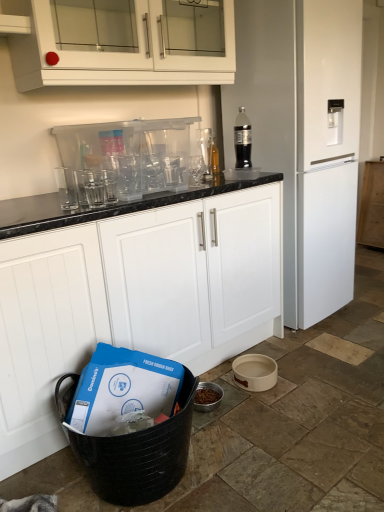
You are a GUI agent. You are given a task and a screenshot of the screen. Output one action in this format:
    pyautogui.click(x=<x>, y=<y>)
    Task: Click on the free space above white ceramic bowl at lower right, which is the 2th appliance in top-to-bottom order (from a real-world perspective)
    The height and width of the screenshot is (512, 384).
    Given the screenshot: What is the action you would take?
    pyautogui.click(x=254, y=366)